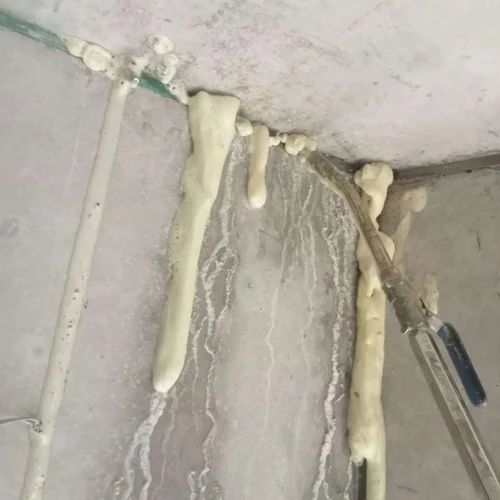
Where is `grey wall`? This screenshot has width=500, height=500. grey wall is located at coordinates (469, 275).